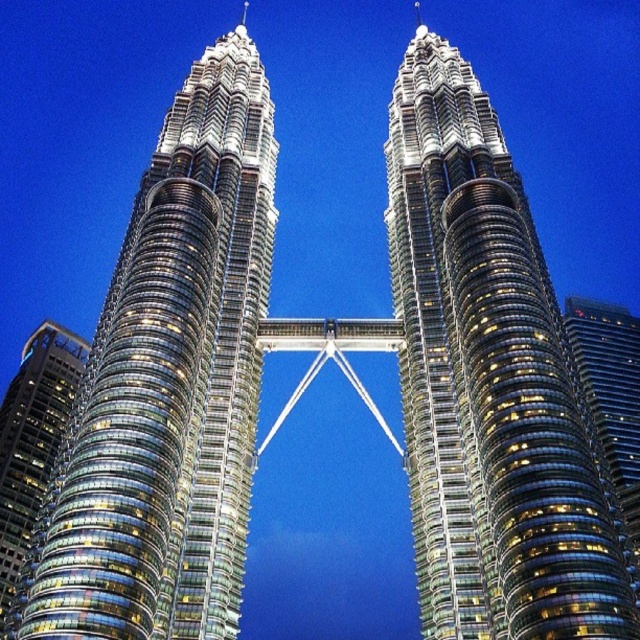
Is glassy metallic skyscraper at center closer to the viewer compared to glassy steel skyscraper at center?

That is True.

Between glassy metallic skyscraper at center and glassy steel skyscraper at center, which one has less height?

Standing shorter between the two is glassy steel skyscraper at center.

Locate an element on the screen. The image size is (640, 640). glassy metallic skyscraper at center is located at coordinates (170, 385).

What do you see at coordinates (170, 385) in the screenshot? I see `glassy metallic skyscraper at center` at bounding box center [170, 385].

Is glassy metallic skyscraper at center in front of glassy steel skyscraper at left?

Yes.

Between point (189, 337) and point (81, 346), which one is positioned in front?

Positioned in front is point (189, 337).

At what (x,y) coordinates should I click in order to perform the action: click on glassy metallic skyscraper at center. Please return your answer as a coordinate pair (x, y). This screenshot has width=640, height=640. Looking at the image, I should click on (170, 385).

Who is positioned more to the left, glassy steel skyscraper at center or glassy steel skyscraper at left?

From the viewer's perspective, glassy steel skyscraper at left appears more on the left side.

Between glassy steel skyscraper at center and glassy steel skyscraper at left, which one is positioned higher?

Positioned higher is glassy steel skyscraper at center.

Is point (520, 298) positioned in front of point (38, 401)?

Yes, it is.

I want to click on glassy steel skyscraper at center, so click(490, 384).